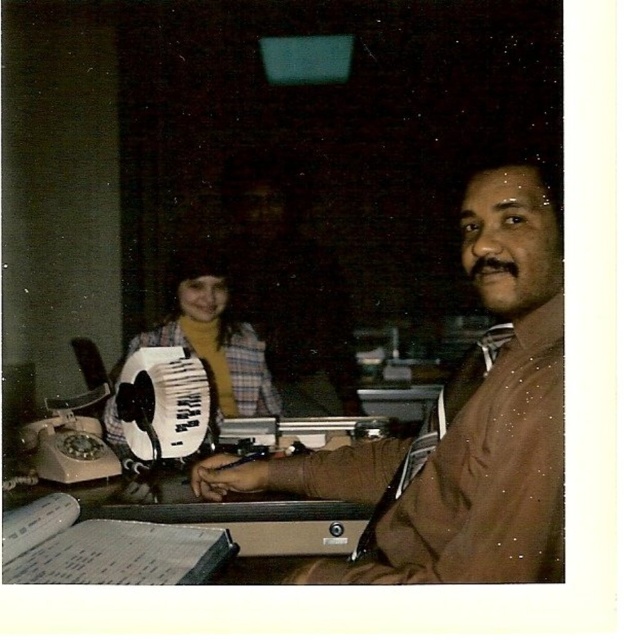
Question: Does brown smooth shirt at right have a smaller size compared to plaid fabric accordion at center?

Choices:
 (A) yes
 (B) no

Answer: (B)

Question: Which object is closer to the camera taking this photo?

Choices:
 (A) brown smooth shirt at right
 (B) plaid fabric accordion at center

Answer: (A)

Question: Is brown smooth shirt at right behind plaid fabric accordion at center?

Choices:
 (A) yes
 (B) no

Answer: (B)

Question: Does brown smooth shirt at right appear over plaid fabric accordion at center?

Choices:
 (A) yes
 (B) no

Answer: (A)

Question: Among these objects, which one is farthest from the camera?

Choices:
 (A) brown smooth shirt at right
 (B) plaid fabric accordion at center

Answer: (B)